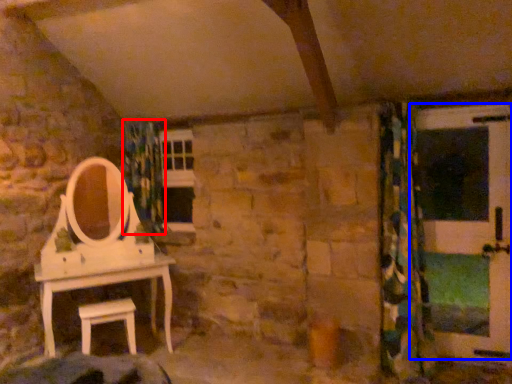
Question: Which point is closer to the camera, shower curtain (highlighted by a red box) or screen door (highlighted by a blue box)?

Choices:
 (A) shower curtain
 (B) screen door

Answer: (B)